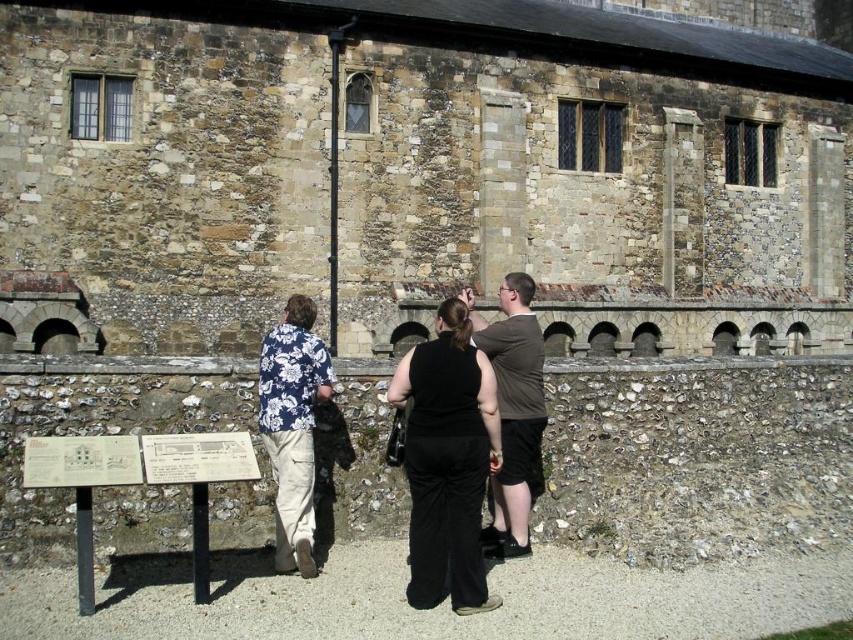
Question: Which point appears farthest from the camera in this image?

Choices:
 (A) (514, 378)
 (B) (306, 563)

Answer: (A)

Question: Can you confirm if stone wall at center is positioned to the right of brown cotton t-shirt at center?

Choices:
 (A) no
 (B) yes

Answer: (B)

Question: Is stone wall at center to the right of brown cotton t-shirt at center from the viewer's perspective?

Choices:
 (A) yes
 (B) no

Answer: (A)

Question: Considering the real-world distances, which object is farthest from the floral fabric shirt at center?

Choices:
 (A) brown cotton t-shirt at center
 (B) stone wall at center
 (C) black matte pants at center
 (D) white paper sign at center

Answer: (B)

Question: Which object is positioned closest to the black matte pants at center?

Choices:
 (A) white paper sign at center
 (B) floral fabric shirt at center

Answer: (B)

Question: Observing the image, what is the correct spatial positioning of floral fabric shirt at center in reference to brown cotton t-shirt at center?

Choices:
 (A) right
 (B) left

Answer: (B)